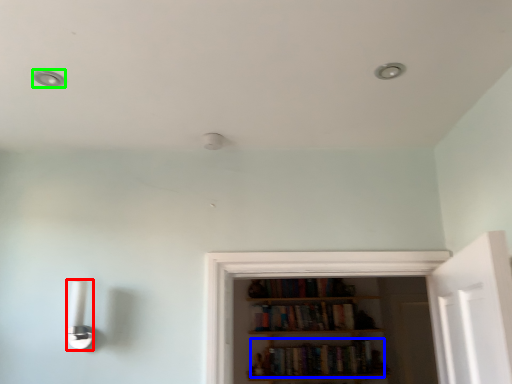
Question: Based on their relative distances, which object is nearer to light fixture (highlighted by a red box)? Choose from book (highlighted by a blue box) and dot (highlighted by a green box).

Choices:
 (A) book
 (B) dot

Answer: (B)